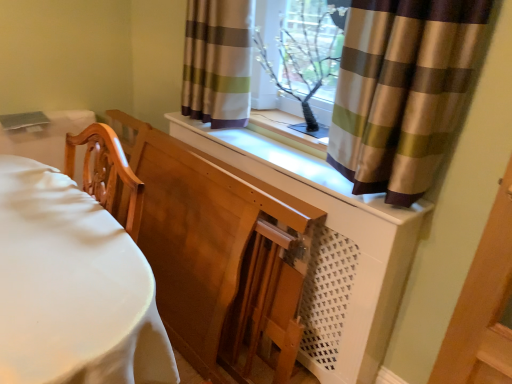
You are a GUI agent. You are given a task and a screenshot of the screen. Output one action in this format:
    pyautogui.click(x=<x>, y=<y>)
    Task: Click on the blank space situated above white matte dresser at center (from a real-world perspective)
    The width and height of the screenshot is (512, 384).
    Given the screenshot: What is the action you would take?
    pyautogui.click(x=275, y=154)